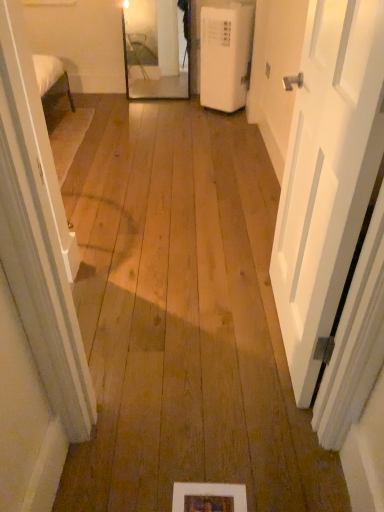
Image resolution: width=384 pixels, height=512 pixels. In order to click on white matte door at right in this screenshot , I will do click(x=327, y=175).

What is the approximate height of white plastic air conditioner at right?

white plastic air conditioner at right is 32.94 inches tall.

Locate an element on the screen. The width and height of the screenshot is (384, 512). white plastic air conditioner at right is located at coordinates (225, 56).

At what (x,y) coordinates should I click in order to perform the action: click on wooden picture frame at lower center. Please return your answer as a coordinate pair (x, y). The image size is (384, 512). Looking at the image, I should click on point(209,497).

Based on the photo, how many degrees apart are the facing directions of wooden picture frame at lower center and white matte door at right?

There is a 91.1-degree angle between the facing directions of wooden picture frame at lower center and white matte door at right.

Is point (183, 483) less distant than point (287, 321)?

Yes, point (183, 483) is in front of point (287, 321).

The width and height of the screenshot is (384, 512). Find the location of `door on the right side of wooden picture frame at lower center`. door on the right side of wooden picture frame at lower center is located at coordinates (327, 175).

Considering the relative sizes of white matte door at right and white plastic air conditioner at right in the image provided, is white matte door at right smaller than white plastic air conditioner at right?

Yes, white matte door at right is smaller than white plastic air conditioner at right.

You are a GUI agent. You are given a task and a screenshot of the screen. Output one action in this format:
    pyautogui.click(x=<x>, y=<y>)
    Task: Click on the door in front of the white plastic air conditioner at right
    Image resolution: width=384 pixels, height=512 pixels.
    Given the screenshot: What is the action you would take?
    pyautogui.click(x=327, y=175)

In the scene shown: From a real-world perspective, does white matte door at right sit lower than white plastic air conditioner at right?

No, from a real-world perspective, white matte door at right is not beneath white plastic air conditioner at right.

How different are the orientations of white matte door at right and white plastic air conditioner at right in degrees?

There is a 0.638-degree angle between the facing directions of white matte door at right and white plastic air conditioner at right.

From the image's perspective, does wooden picture frame at lower center appear higher than white plastic air conditioner at right?

No, from the image's perspective, wooden picture frame at lower center is not above white plastic air conditioner at right.

Does wooden picture frame at lower center have a lesser height compared to white plastic air conditioner at right?

Correct, wooden picture frame at lower center is not as tall as white plastic air conditioner at right.

At what (x,y) coordinates should I click in order to perform the action: click on air conditioner that is above the wooden picture frame at lower center (from a real-world perspective). Please return your answer as a coordinate pair (x, y). Image resolution: width=384 pixels, height=512 pixels. Looking at the image, I should click on (225, 56).

From a real-world perspective, is white matte door at right physically located above or below wooden picture frame at lower center?

From a real-world perspective, white matte door at right is physically above wooden picture frame at lower center.

Consider the image. Can you confirm if white matte door at right is shorter than wooden picture frame at lower center?

Incorrect, the height of white matte door at right does not fall short of that of wooden picture frame at lower center.

Is point (338, 84) closer to camera compared to point (212, 495)?

Yes, point (338, 84) is in front of point (212, 495).

Is white matte door at right bigger or smaller than wooden picture frame at lower center?

white matte door at right is bigger than wooden picture frame at lower center.

Is white plastic air conditioner at right positioned far away from wooden picture frame at lower center?

Indeed, white plastic air conditioner at right is not near wooden picture frame at lower center.

Is white plastic air conditioner at right looking in the opposite direction of wooden picture frame at lower center?

No, white plastic air conditioner at right is not facing the opposite direction of wooden picture frame at lower center.

Can you confirm if white plastic air conditioner at right is shorter than wooden picture frame at lower center?

In fact, white plastic air conditioner at right may be taller than wooden picture frame at lower center.

From the image's perspective, is white plastic air conditioner at right under wooden picture frame at lower center?

No, from the image's perspective, white plastic air conditioner at right is not beneath wooden picture frame at lower center.

Is white plastic air conditioner at right spatially inside white matte door at right, or outside of it?

white plastic air conditioner at right cannot be found inside white matte door at right.

Between white plastic air conditioner at right and white matte door at right, which one has more height?

With more height is white matte door at right.

Is point (230, 7) positioned in front of point (321, 266)?

That is False.

The height and width of the screenshot is (512, 384). I want to click on door above the wooden picture frame at lower center (from a real-world perspective), so click(x=327, y=175).

Locate an element on the screen. The width and height of the screenshot is (384, 512). air conditioner behind the white matte door at right is located at coordinates (225, 56).

Considering their positions, is wooden picture frame at lower center positioned closer to white plastic air conditioner at right than white matte door at right?

The object closer to white plastic air conditioner at right is white matte door at right.

Looking at the image, which one is located closer to white matte door at right, white plastic air conditioner at right or wooden picture frame at lower center?

wooden picture frame at lower center lies closer to white matte door at right than the other object.

Based on their spatial positions, is wooden picture frame at lower center or white plastic air conditioner at right further from white matte door at right?

white plastic air conditioner at right lies further to white matte door at right than the other object.

Based on their spatial positions, is white matte door at right or white plastic air conditioner at right closer to wooden picture frame at lower center?

white matte door at right lies closer to wooden picture frame at lower center than the other object.

Which object lies nearer to the anchor point wooden picture frame at lower center, white plastic air conditioner at right or white matte door at right?

The object closer to wooden picture frame at lower center is white matte door at right.

Considering their positions, is white matte door at right positioned further to white plastic air conditioner at right than wooden picture frame at lower center?

wooden picture frame at lower center.

At what (x,y) coordinates should I click in order to perform the action: click on picture frame positioned between white matte door at right and white plastic air conditioner at right from near to far. Please return your answer as a coordinate pair (x, y). Image resolution: width=384 pixels, height=512 pixels. Looking at the image, I should click on (209, 497).